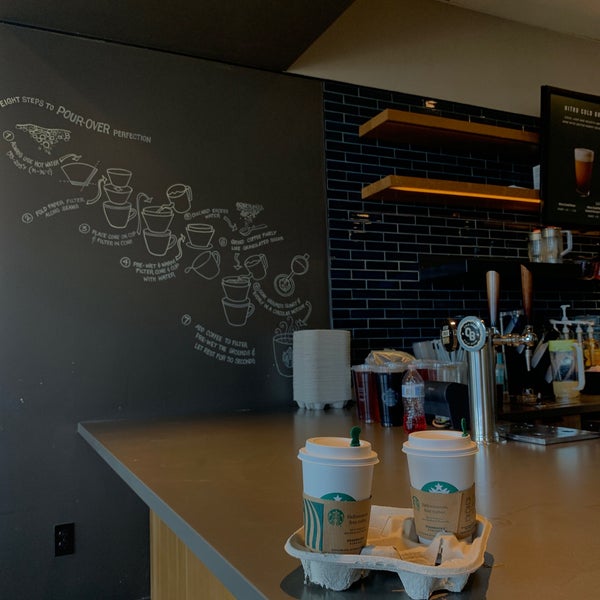
At what (x,y) coordinates should I click in order to perform the action: click on wooden shelves. Please return your answer as a coordinate pair (x, y). Looking at the image, I should click on (484, 191), (479, 130).